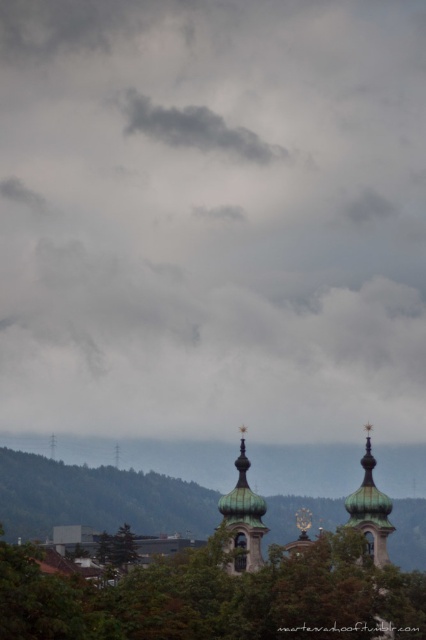
Between cloudy gray sky at upper center and green leafy tree at lower center, which one is positioned lower?

Positioned lower is green leafy tree at lower center.

The image size is (426, 640). What are the coordinates of `cloudy gray sky at upper center` in the screenshot? It's located at (213, 218).

I want to click on cloudy gray sky at upper center, so click(x=213, y=218).

In the scene shown: Which is more to the left, cloudy gray sky at upper center or dark gray cloud at upper center?

dark gray cloud at upper center

Which is behind, point (325, 396) or point (175, 118)?

Positioned behind is point (175, 118).

You are a GUI agent. You are given a task and a screenshot of the screen. Output one action in this format:
    pyautogui.click(x=<x>, y=<y>)
    Task: Click on the cloudy gray sky at upper center
    The image size is (426, 640).
    Given the screenshot: What is the action you would take?
    pyautogui.click(x=213, y=218)

Between point (74, 120) and point (244, 492), which one is positioned in front?

Point (244, 492) is more forward.

Can you confirm if cloudy gray sky at upper center is shorter than copper dome at center?

In fact, cloudy gray sky at upper center may be taller than copper dome at center.

Who is more distant from viewer, [42,365] or [255,560]?

The point [42,365] is more distant.

The height and width of the screenshot is (640, 426). Find the location of `cloudy gray sky at upper center`. cloudy gray sky at upper center is located at coordinates (213, 218).